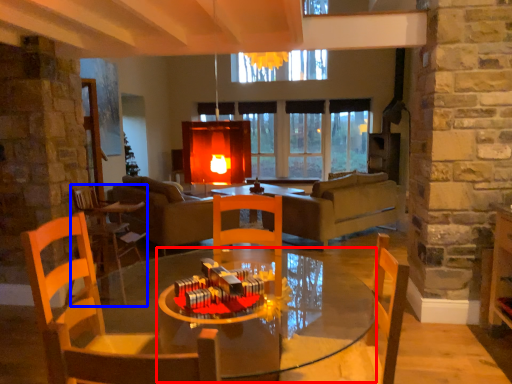
Question: Which object appears farthest to the camera in this image, round table (highlighted by a red box) or chair (highlighted by a blue box)?

Choices:
 (A) round table
 (B) chair

Answer: (B)